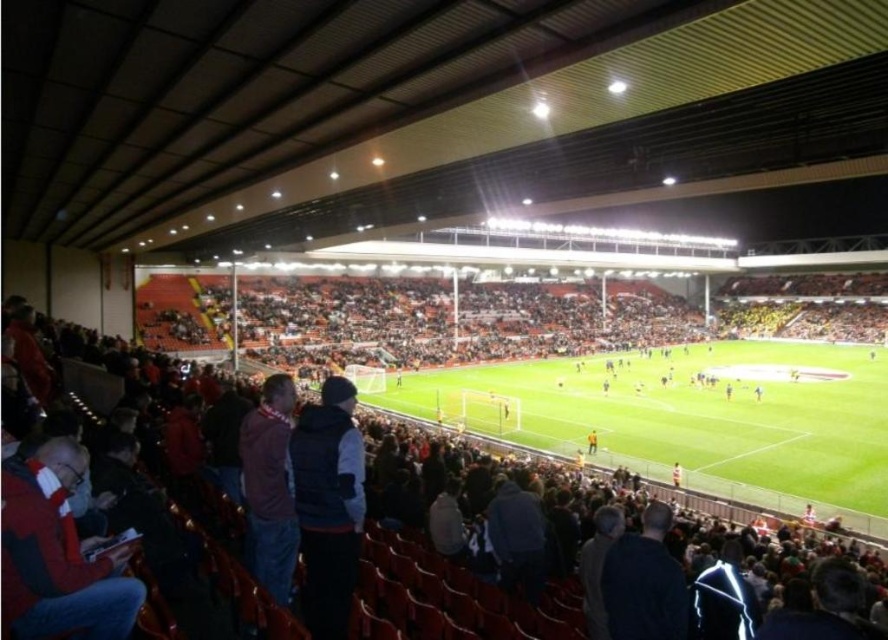
You are standing at the edge of the football field and want to throw a ball to a friend sitting in the dark red seats at center. If your throwing range is 5 meters, can you reach them?

The distance between you and the dark red seats at center is 4.91 meters, which is within your throwing range of 5 meters. Yes, you can reach them.

You are a spectator at the football stadium and want to identify the smaller item between the red fleece scarf at lower left and the dark red sweater at lower left. Which one should you point out?

→ The red fleece scarf at lower left is smaller than the dark red sweater at lower left, so you should point out the red fleece scarf at lower left.